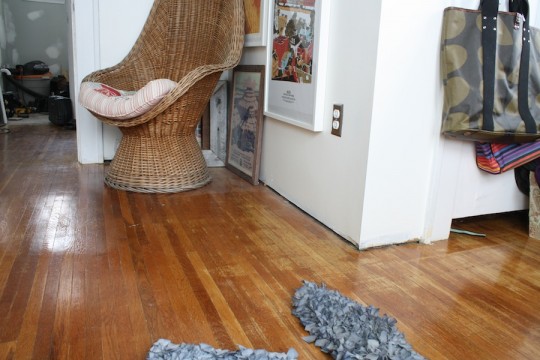
Find the location of a particular element. folded light gray rugs is located at coordinates (347, 331), (217, 354).